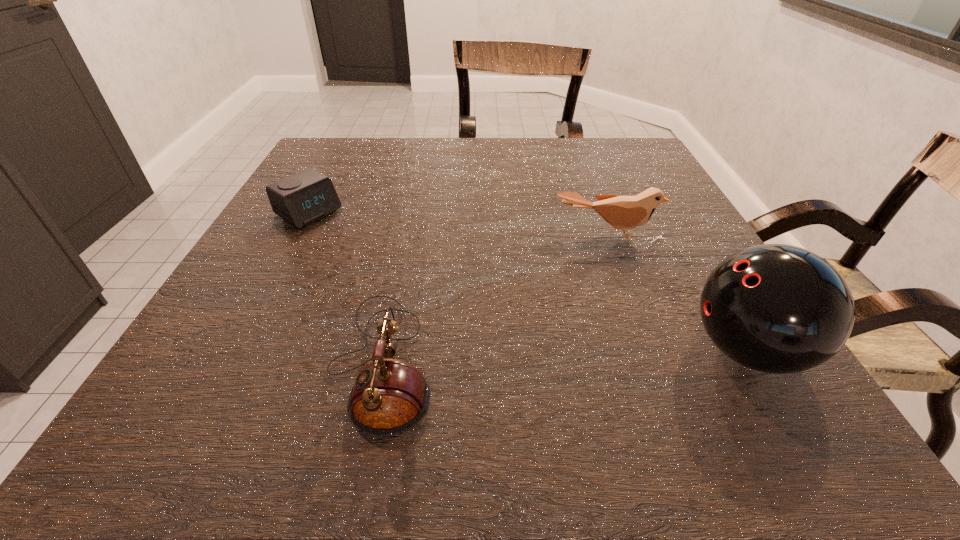
Where is `free spot located on the surface of the tallest object near the finger holes`? This screenshot has height=540, width=960. free spot located on the surface of the tallest object near the finger holes is located at coordinates (636, 350).

You are a GUI agent. You are given a task and a screenshot of the screen. Output one action in this format:
    pyautogui.click(x=<x>, y=<y>)
    Task: Click on the blank area located 0.190m on the front-facing side of the shortest object
    
    Given the screenshot: What is the action you would take?
    pyautogui.click(x=389, y=260)

Where is `vacant region located on the front-facing side of the shortest object`? This screenshot has height=540, width=960. vacant region located on the front-facing side of the shortest object is located at coordinates (426, 282).

Where is `vacant point located on the front-facing side of the shortest object`? Image resolution: width=960 pixels, height=540 pixels. vacant point located on the front-facing side of the shortest object is located at coordinates (368, 247).

This screenshot has height=540, width=960. Find the location of `vacant space located 0.100m at the beak of the bird`. vacant space located 0.100m at the beak of the bird is located at coordinates (605, 280).

The height and width of the screenshot is (540, 960). I want to click on vacant space located 0.310m at the beak of the bird, so click(x=610, y=375).

Where is `blank space located at the beak of the bird`? This screenshot has height=540, width=960. blank space located at the beak of the bird is located at coordinates (606, 303).

This screenshot has width=960, height=540. What are the coordinates of `telephone present at the near edge` in the screenshot? It's located at (390, 396).

This screenshot has height=540, width=960. I want to click on bowling ball located at the near edge, so click(x=775, y=308).

Where is `object situated at the left edge`? Image resolution: width=960 pixels, height=540 pixels. object situated at the left edge is located at coordinates (305, 197).